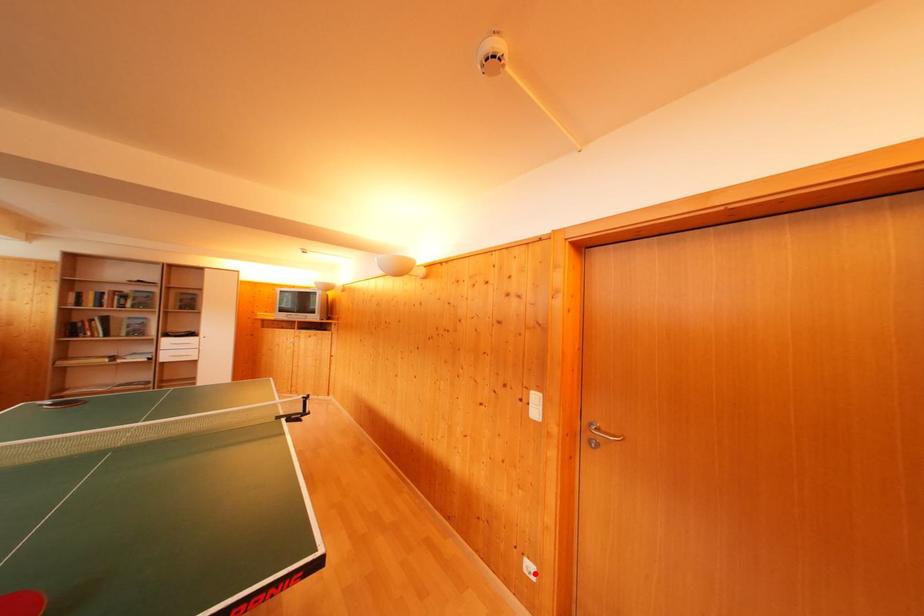
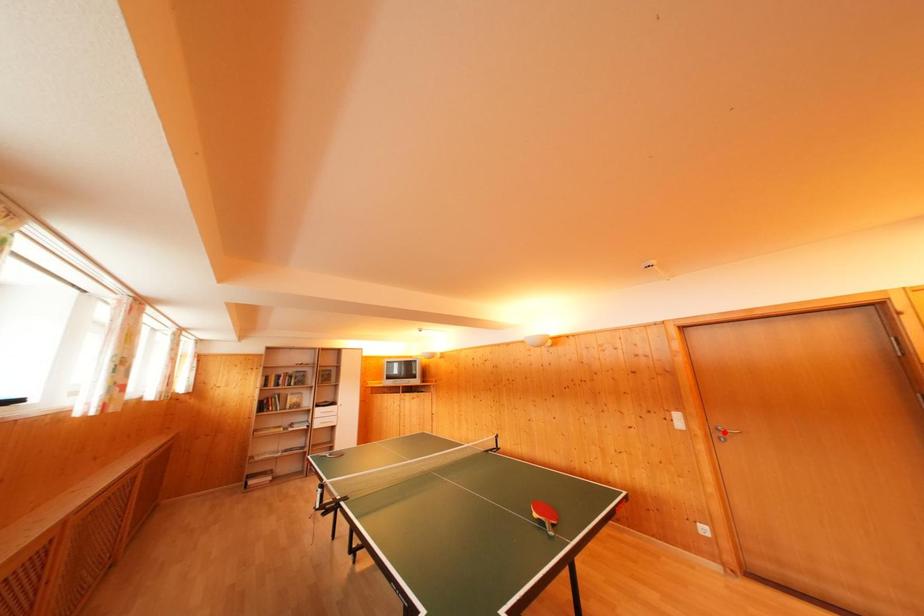
I am providing you with two images of the same scene from different viewpoints. A red point is marked on the first image and another point is marked on the second image. Are the points marked in image1 and image2 representing the same 3D position?

No